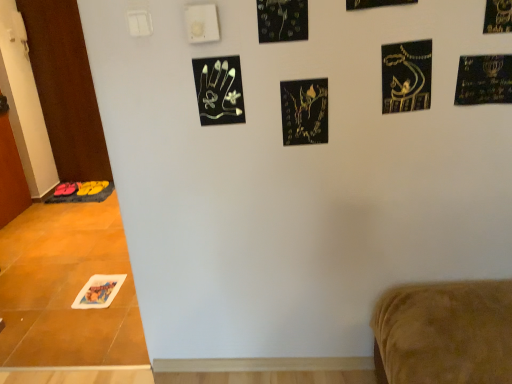
Question: Does brown wood door at left, placed as the first door when sorted from back to front, have a greater width compared to black glossy leaves at upper center, placed as the 5th print when sorted from back to front?

Choices:
 (A) no
 (B) yes

Answer: (B)

Question: Considering the relative positions of brown wood door at left, placed as the first door when sorted from back to front, and black glossy leaves at upper center, acting as the fourth print starting from the right, in the image provided, is brown wood door at left, placed as the first door when sorted from back to front, to the right of black glossy leaves at upper center, acting as the fourth print starting from the right, from the viewer's perspective?

Choices:
 (A) no
 (B) yes

Answer: (A)

Question: From the image's perspective, would you say brown wood door at left, positioned as the second door in front-to-back order, is shown under black glossy leaves at upper center, the second print positioned from the front?

Choices:
 (A) yes
 (B) no

Answer: (B)

Question: Is brown wood door at left, positioned as the second door in front-to-back order, turned away from black glossy leaves at upper center, arranged as the third print when viewed from the left?

Choices:
 (A) yes
 (B) no

Answer: (B)

Question: Is brown wood door at left, placed as the first door when sorted from back to front, with black glossy leaves at upper center, which is counted as the 5th print, starting from the bottom?

Choices:
 (A) no
 (B) yes

Answer: (A)

Question: Is black glossy leaves at upper center, acting as the fourth print starting from the right, inside the boundaries of gold metallic menorah at upper right, or outside?

Choices:
 (A) outside
 (B) inside

Answer: (A)

Question: In the image, is black glossy leaves at upper center, acting as the 2th print starting from the top, positioned in front of or behind gold metallic menorah at upper right?

Choices:
 (A) front
 (B) behind

Answer: (A)

Question: Looking at their shapes, would you say black glossy leaves at upper center, the second print positioned from the front, is wider or thinner than gold metallic menorah at upper right?

Choices:
 (A) thin
 (B) wide

Answer: (A)

Question: Considering the relative positions of black glossy leaves at upper center, acting as the 2th print starting from the top, and gold metallic menorah at upper right in the image provided, is black glossy leaves at upper center, acting as the 2th print starting from the top, to the left or to the right of gold metallic menorah at upper right?

Choices:
 (A) left
 (B) right

Answer: (A)

Question: From the image's perspective, is white glossy door at left, the first door viewed from the front, positioned above or below gold metallic menorah at upper right?

Choices:
 (A) above
 (B) below

Answer: (A)

Question: From a real-world perspective, relative to gold metallic menorah at upper right, is white glossy door at left, the first door viewed from the front, vertically above or below?

Choices:
 (A) above
 (B) below

Answer: (B)

Question: Considering the positions of point (10, 115) and point (498, 56), is point (10, 115) closer or farther from the camera than point (498, 56)?

Choices:
 (A) closer
 (B) farther

Answer: (B)

Question: In terms of height, does white glossy door at left, the first door viewed from the front, look taller or shorter compared to gold metallic menorah at upper right?

Choices:
 (A) short
 (B) tall

Answer: (B)

Question: From a real-world perspective, is gold metallic menorah at upper right physically located above or below black metallic handprint at upper center, the third print ordered from the bottom?

Choices:
 (A) below
 (B) above

Answer: (A)

Question: Considering the positions of gold metallic menorah at upper right and black metallic handprint at upper center, positioned as the 4th print in top-to-bottom order, in the image, is gold metallic menorah at upper right bigger or smaller than black metallic handprint at upper center, positioned as the 4th print in top-to-bottom order,?

Choices:
 (A) big
 (B) small

Answer: (A)